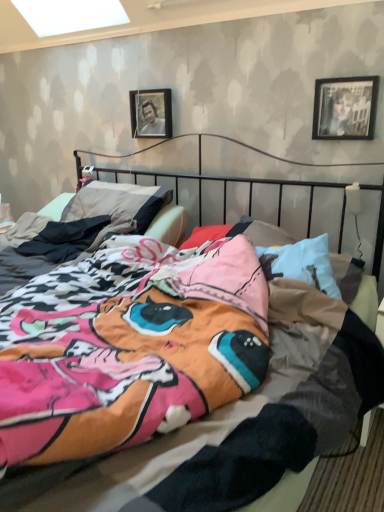
This screenshot has width=384, height=512. I want to click on black glossy photo frame at upper right, acting as the 2th picture frame starting from the back, so click(x=345, y=108).

Image resolution: width=384 pixels, height=512 pixels. Describe the element at coordinates (345, 108) in the screenshot. I see `black glossy photo frame at upper right, placed as the 1th picture frame when sorted from right to left` at that location.

This screenshot has height=512, width=384. I want to click on wooden frame at upper center, marked as the 2th picture frame in a front-to-back arrangement, so click(151, 113).

Image resolution: width=384 pixels, height=512 pixels. Describe the element at coordinates (151, 113) in the screenshot. I see `wooden frame at upper center, marked as the 2th picture frame in a front-to-back arrangement` at that location.

Identify the location of black glossy photo frame at upper right, acting as the 2th picture frame starting from the back. The image size is (384, 512). (345, 108).

Does wooden frame at upper center, acting as the 1th picture frame starting from the left, appear on the left side of black glossy photo frame at upper right, acting as the 2th picture frame starting from the back?

Indeed, wooden frame at upper center, acting as the 1th picture frame starting from the left, is positioned on the left side of black glossy photo frame at upper right, acting as the 2th picture frame starting from the back.

Considering their positions, is wooden frame at upper center, positioned as the 1th picture frame in back-to-front order, located in front of or behind black glossy photo frame at upper right, the first picture frame when ordered from front to back?

wooden frame at upper center, positioned as the 1th picture frame in back-to-front order, is behind black glossy photo frame at upper right, the first picture frame when ordered from front to back.

Considering the positions of point (133, 133) and point (331, 83), is point (133, 133) closer or farther from the camera than point (331, 83)?

Point (133, 133) appears to be farther away from the viewer than point (331, 83).

From the image's perspective, between wooden frame at upper center, positioned as the 1th picture frame in back-to-front order, and black glossy photo frame at upper right, the first picture frame when ordered from front to back, who is located below?

black glossy photo frame at upper right, the first picture frame when ordered from front to back, is shown below in the image.

Consider the image. From a real-world perspective, is wooden frame at upper center, acting as the 1th picture frame starting from the left, physically located above or below black glossy photo frame at upper right, the first picture frame when ordered from front to back?

From a real-world perspective, wooden frame at upper center, acting as the 1th picture frame starting from the left, is physically below black glossy photo frame at upper right, the first picture frame when ordered from front to back.

Can you confirm if wooden frame at upper center, acting as the 1th picture frame starting from the left, is thinner than black glossy photo frame at upper right, acting as the 2th picture frame starting from the back?

Incorrect, the width of wooden frame at upper center, acting as the 1th picture frame starting from the left, is not less than that of black glossy photo frame at upper right, acting as the 2th picture frame starting from the back.

In terms of height, does wooden frame at upper center, marked as the 2th picture frame in a front-to-back arrangement, look taller or shorter compared to black glossy photo frame at upper right, the 2th picture frame from the left?

wooden frame at upper center, marked as the 2th picture frame in a front-to-back arrangement, is shorter than black glossy photo frame at upper right, the 2th picture frame from the left.

Looking at the image, does wooden frame at upper center, marked as the 2th picture frame in a front-to-back arrangement, seem bigger or smaller compared to black glossy photo frame at upper right, placed as the 1th picture frame when sorted from right to left?

Considering their sizes, wooden frame at upper center, marked as the 2th picture frame in a front-to-back arrangement, takes up more space than black glossy photo frame at upper right, placed as the 1th picture frame when sorted from right to left.

Is wooden frame at upper center, marked as the 2th picture frame in a right-to-left arrangement, inside or outside of black glossy photo frame at upper right, the first picture frame when ordered from front to back?

The correct answer is: outside.

Is wooden frame at upper center, marked as the 2th picture frame in a front-to-back arrangement, looking in the opposite direction of black glossy photo frame at upper right, the first picture frame when ordered from front to back?

No.

From the picture: How many degrees apart are the facing directions of wooden frame at upper center, acting as the 1th picture frame starting from the left, and black glossy photo frame at upper right, acting as the 2th picture frame starting from the back?

They differ by 0.959 degrees in their facing directions.

Could you measure the distance between wooden frame at upper center, acting as the 1th picture frame starting from the left, and black glossy photo frame at upper right, the first picture frame when ordered from front to back?

The distance of wooden frame at upper center, acting as the 1th picture frame starting from the left, from black glossy photo frame at upper right, the first picture frame when ordered from front to back, is 36.45 inches.

You are a GUI agent. You are given a task and a screenshot of the screen. Output one action in this format:
    pyautogui.click(x=<x>, y=<y>)
    Task: Click on the picture frame that is under the black glossy photo frame at upper right, the 2th picture frame from the left (from a real-world perspective)
    
    Given the screenshot: What is the action you would take?
    pyautogui.click(x=151, y=113)

Which object is positioned more to the right, black glossy photo frame at upper right, the 2th picture frame from the left, or wooden frame at upper center, positioned as the 1th picture frame in back-to-front order?

black glossy photo frame at upper right, the 2th picture frame from the left.

Does black glossy photo frame at upper right, acting as the 2th picture frame starting from the back, come in front of wooden frame at upper center, marked as the 2th picture frame in a front-to-back arrangement?

Yes, the depth of black glossy photo frame at upper right, acting as the 2th picture frame starting from the back, is less than that of wooden frame at upper center, marked as the 2th picture frame in a front-to-back arrangement.

Which is more distant, (347, 81) or (167, 106)?

Point (167, 106)

From the image's perspective, relative to wooden frame at upper center, marked as the 2th picture frame in a front-to-back arrangement, is black glossy photo frame at upper right, acting as the 2th picture frame starting from the back, above or below?

black glossy photo frame at upper right, acting as the 2th picture frame starting from the back, is below wooden frame at upper center, marked as the 2th picture frame in a front-to-back arrangement.

From a real-world perspective, relative to wooden frame at upper center, positioned as the 1th picture frame in back-to-front order, is black glossy photo frame at upper right, acting as the 2th picture frame starting from the back, vertically above or below?

Clearly, from a real-world perspective, black glossy photo frame at upper right, acting as the 2th picture frame starting from the back, is above wooden frame at upper center, positioned as the 1th picture frame in back-to-front order.

Considering the sizes of black glossy photo frame at upper right, the first picture frame when ordered from front to back, and wooden frame at upper center, acting as the 1th picture frame starting from the left, in the image, is black glossy photo frame at upper right, the first picture frame when ordered from front to back, wider or thinner than wooden frame at upper center, acting as the 1th picture frame starting from the left,?

black glossy photo frame at upper right, the first picture frame when ordered from front to back, is thinner than wooden frame at upper center, acting as the 1th picture frame starting from the left.

Who is shorter, black glossy photo frame at upper right, placed as the 1th picture frame when sorted from right to left, or wooden frame at upper center, positioned as the 1th picture frame in back-to-front order?

With less height is wooden frame at upper center, positioned as the 1th picture frame in back-to-front order.

Who is smaller, black glossy photo frame at upper right, placed as the 1th picture frame when sorted from right to left, or wooden frame at upper center, acting as the 1th picture frame starting from the left?

black glossy photo frame at upper right, placed as the 1th picture frame when sorted from right to left, is smaller.

Do you think black glossy photo frame at upper right, acting as the 2th picture frame starting from the back, is within wooden frame at upper center, marked as the 2th picture frame in a front-to-back arrangement, or outside of it?

black glossy photo frame at upper right, acting as the 2th picture frame starting from the back, lies outside wooden frame at upper center, marked as the 2th picture frame in a front-to-back arrangement.

Are black glossy photo frame at upper right, the first picture frame when ordered from front to back, and wooden frame at upper center, marked as the 2th picture frame in a right-to-left arrangement, beside each other?

There is a gap between black glossy photo frame at upper right, the first picture frame when ordered from front to back, and wooden frame at upper center, marked as the 2th picture frame in a right-to-left arrangement.

Does black glossy photo frame at upper right, the 2th picture frame from the left, turn towards wooden frame at upper center, acting as the 1th picture frame starting from the left?

A: No, black glossy photo frame at upper right, the 2th picture frame from the left, is not turned towards wooden frame at upper center, acting as the 1th picture frame starting from the left.

In the scene shown: Could you measure the distance between black glossy photo frame at upper right, the first picture frame when ordered from front to back, and wooden frame at upper center, marked as the 2th picture frame in a front-to-back arrangement?

black glossy photo frame at upper right, the first picture frame when ordered from front to back, and wooden frame at upper center, marked as the 2th picture frame in a front-to-back arrangement, are 36.45 inches apart.

Identify the location of picture frame on the right of wooden frame at upper center, acting as the 1th picture frame starting from the left. (345, 108).

Locate an element on the screen. The height and width of the screenshot is (512, 384). picture frame that appears in front of the wooden frame at upper center, marked as the 2th picture frame in a front-to-back arrangement is located at coordinates (345, 108).

Locate an element on the screen. picture frame lying below the wooden frame at upper center, acting as the 1th picture frame starting from the left (from the image's perspective) is located at coordinates (345, 108).